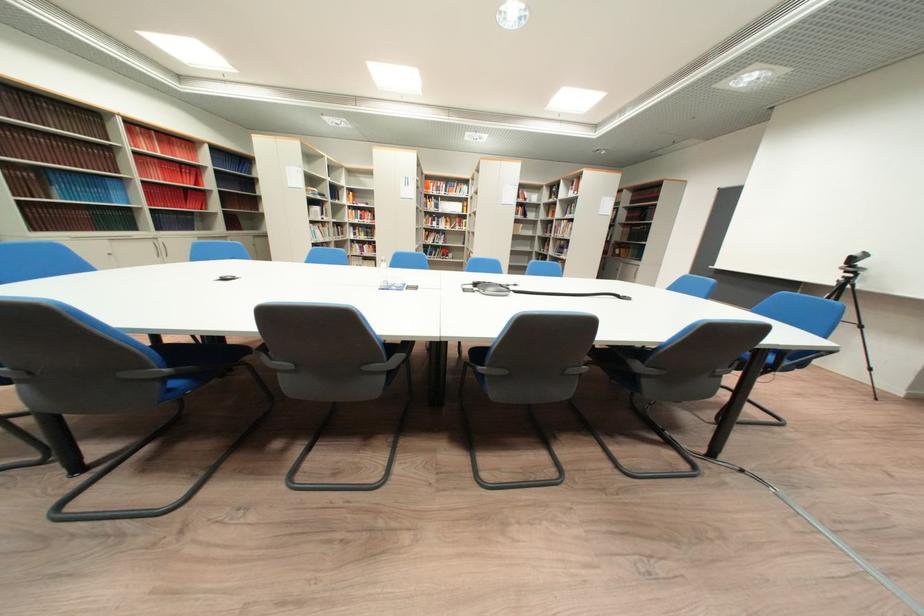
Identify the location of glass water bottle. The image size is (924, 616). (383, 274).